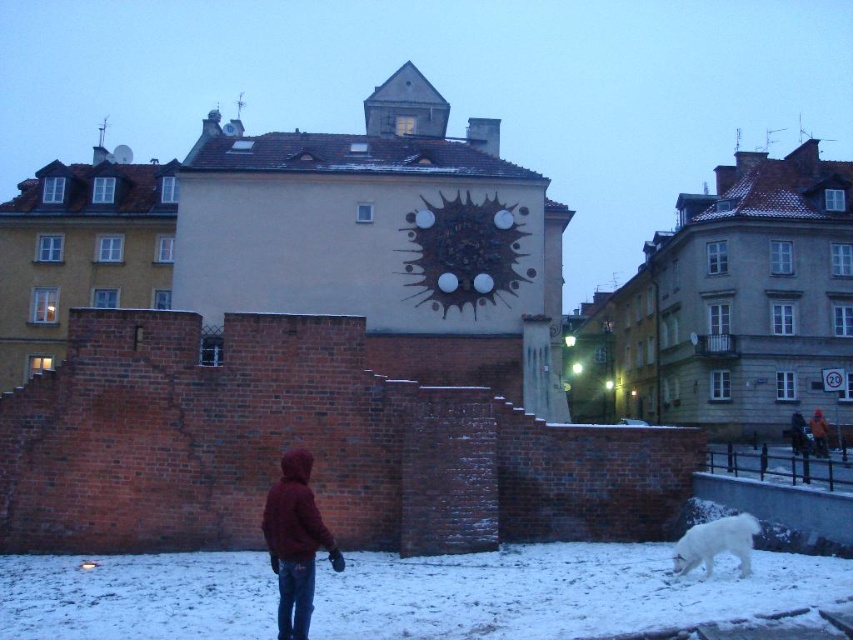
You are standing in the winter scene and want to walk from the maroon hoodie at center to the white powdery snow at lower center. Which direction should you move?

The white powdery snow at lower center is to the right of the maroon hoodie at center, so you should move to the right to reach it.

You are standing in the winter scene and want to step onto the white powdery snow at lower center. Is the maroon hoodie at center blocking your path?

The white powdery snow at lower center is closer to the viewer than the maroon hoodie at center, so the maroon hoodie at center is behind the snow and not blocking the path.